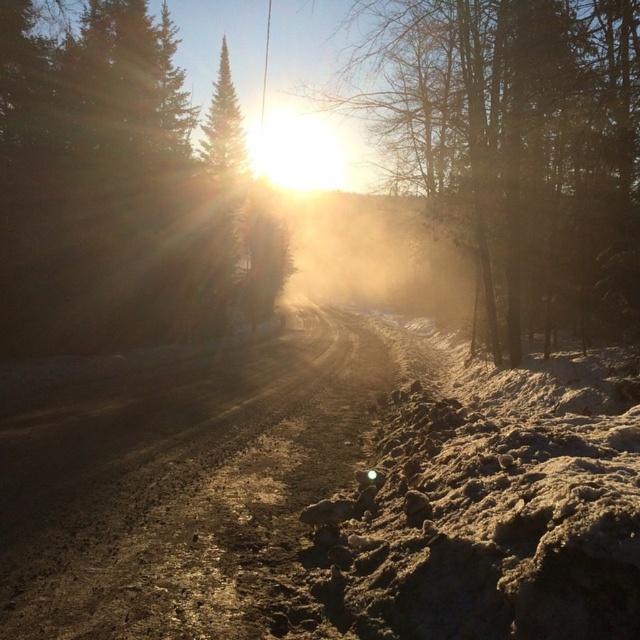
Does dull brown dirt track at center appear over green matte tree at upper left?

No, dull brown dirt track at center is not above green matte tree at upper left.

Is dull brown dirt track at center below green matte tree at upper left?

Yes, dull brown dirt track at center is below green matte tree at upper left.

This screenshot has width=640, height=640. Identify the location of dull brown dirt track at center. (179, 486).

Identify the location of dull brown dirt track at center. (179, 486).

Which is in front, point (253, 225) or point (513, 266)?

Point (513, 266)

Measure the distance between green matte tree at upper left and camera.

They are 15.42 meters apart.

Which is behind, point (182, 257) or point (397, 104)?

Point (397, 104)

At what (x,y) coordinates should I click in order to perform the action: click on green matte tree at upper left. Please return your answer as a coordinate pair (x, y). The height and width of the screenshot is (640, 640). Looking at the image, I should click on (122, 189).

Does dull brown dirt track at center appear under dull brown tree at center?

Yes.

Identify the location of dull brown dirt track at center. This screenshot has width=640, height=640. (179, 486).